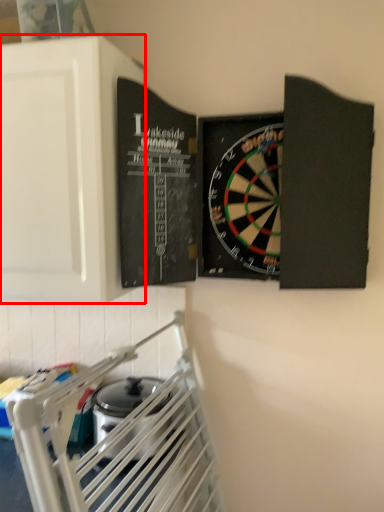
Question: From the image's perspective, considering the relative positions of cabinetry (annotated by the red box) and appliance in the image provided, where is cabinetry (annotated by the red box) located with respect to the staircase?

Choices:
 (A) above
 (B) below

Answer: (A)